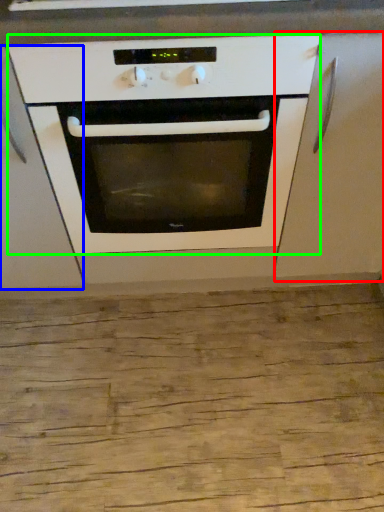
Question: Based on their relative distances, which object is farther from cabinetry (highlighted by a red box)? Choose from cabinetry (highlighted by a blue box) and oven (highlighted by a green box).

Choices:
 (A) cabinetry
 (B) oven

Answer: (A)